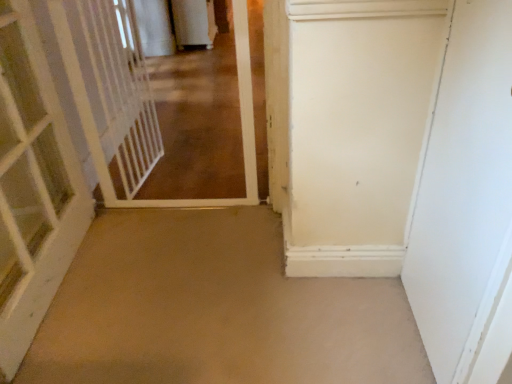
This screenshot has height=384, width=512. In order to click on spots to the right of white wooden door at left, the 2th door viewed from the right in this screenshot , I will do `click(168, 282)`.